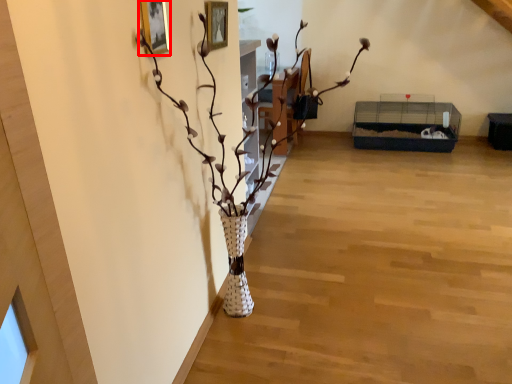
Question: In this image, where is picture frame (annotated by the red box) located relative to houseplant?

Choices:
 (A) right
 (B) left

Answer: (B)